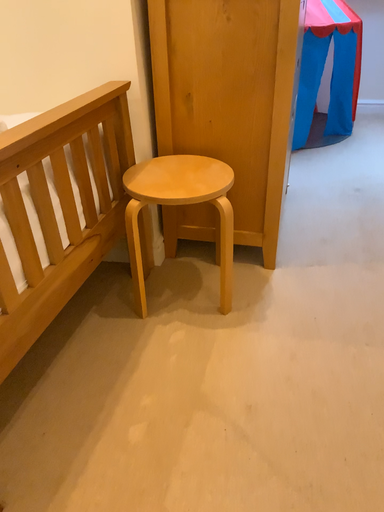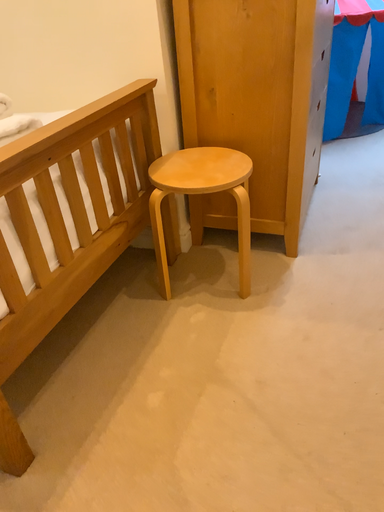
Question: Which way did the camera rotate in the video?

Choices:
 (A) rotated right
 (B) rotated left

Answer: (B)